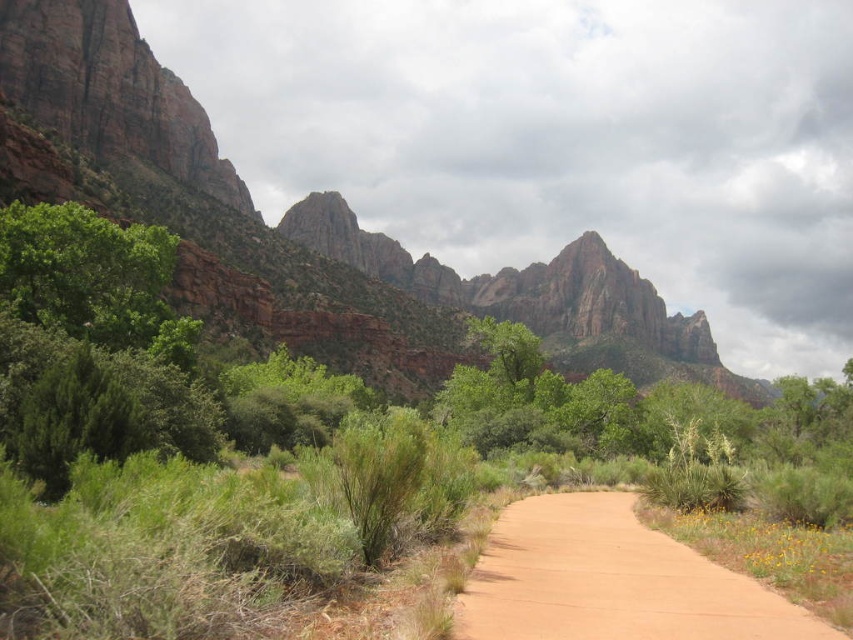
You are a hiker planning to walk along the dirt path in the image. You notice the green leafy shrubs at center and the rustic rock formation at upper center. Which object is larger in size?

The rustic rock formation at upper center is larger than the green leafy shrubs at center.

You are hiking along the sandy dirt path at center and want to rest under the green leafy shrubs at center. Can you reach the shrubs from your current position on the path?

The green leafy shrubs at center is above the sandy dirt path at center, so yes, you can reach the shrubs by moving upwards from the path.

You are a hiker planning to walk along the sandy dirt path at center. You notice green leafy shrubs at center nearby. Which object is bigger in size?

The green leafy shrubs at center are larger in size compared to the sandy dirt path at center.